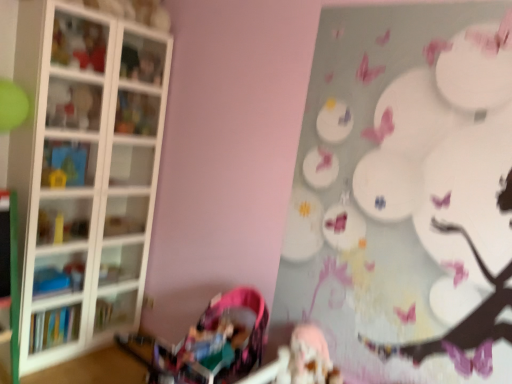
Question: From a real-world perspective, is translucent glass shelf at upper left, which appears as the 5th shelf when ordered from the bottom, on top of matte plastic shelf at upper left, the fourth shelf when ordered from bottom to top?

Choices:
 (A) yes
 (B) no

Answer: (B)

Question: Does translucent glass shelf at upper left, the 1th shelf when ordered from top to bottom, have a greater height compared to matte plastic shelf at upper left, the fourth shelf when ordered from bottom to top?

Choices:
 (A) no
 (B) yes

Answer: (A)

Question: From the image's perspective, is translucent glass shelf at upper left, which appears as the 5th shelf when ordered from the bottom, located beneath matte plastic shelf at upper left, which is the second shelf from top to bottom?

Choices:
 (A) yes
 (B) no

Answer: (B)

Question: Considering the relative sizes of translucent glass shelf at upper left, which appears as the 5th shelf when ordered from the bottom, and matte plastic shelf at upper left, which is the second shelf from top to bottom, in the image provided, is translucent glass shelf at upper left, which appears as the 5th shelf when ordered from the bottom, wider than matte plastic shelf at upper left, which is the second shelf from top to bottom,?

Choices:
 (A) yes
 (B) no

Answer: (B)

Question: Is translucent glass shelf at upper left, which appears as the 5th shelf when ordered from the bottom, facing towards matte plastic shelf at upper left, the fourth shelf when ordered from bottom to top?

Choices:
 (A) no
 (B) yes

Answer: (A)

Question: Can we say translucent glass shelf at upper left, the 1th shelf when ordered from top to bottom, lies outside matte plastic shelf at upper left, the fourth shelf when ordered from bottom to top?

Choices:
 (A) yes
 (B) no

Answer: (A)

Question: Would you consider hardcover book at left to be distant from blue plastic shelf at left, the fifth shelf from the top?

Choices:
 (A) no
 (B) yes

Answer: (A)

Question: Can you confirm if hardcover book at left is bigger than blue plastic shelf at left, which is the 1th shelf from bottom to top?

Choices:
 (A) no
 (B) yes

Answer: (B)

Question: Is hardcover book at left completely or partially outside of blue plastic shelf at left, the fifth shelf from the top?

Choices:
 (A) no
 (B) yes

Answer: (B)

Question: Is hardcover book at left wider than blue plastic shelf at left, the fifth shelf from the top?

Choices:
 (A) yes
 (B) no

Answer: (B)

Question: Can you confirm if hardcover book at left is taller than blue plastic shelf at left, which is the 1th shelf from bottom to top?

Choices:
 (A) yes
 (B) no

Answer: (A)

Question: Are hardcover book at left and blue plastic shelf at left, the fifth shelf from the top, beside each other?

Choices:
 (A) yes
 (B) no

Answer: (B)

Question: Is matte plastic shelf at upper left, the fourth shelf when ordered from bottom to top, shorter than matte white cabinet at upper left?

Choices:
 (A) yes
 (B) no

Answer: (B)